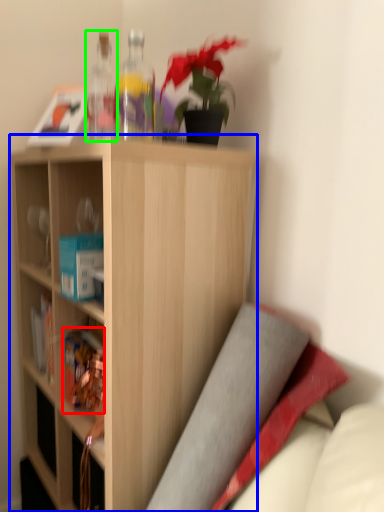
Question: Estimate the real-world distances between objects in this image. Which object is closer to book (highlighted by a red box), shelf (highlighted by a blue box) or bottle (highlighted by a green box)?

Choices:
 (A) shelf
 (B) bottle

Answer: (A)